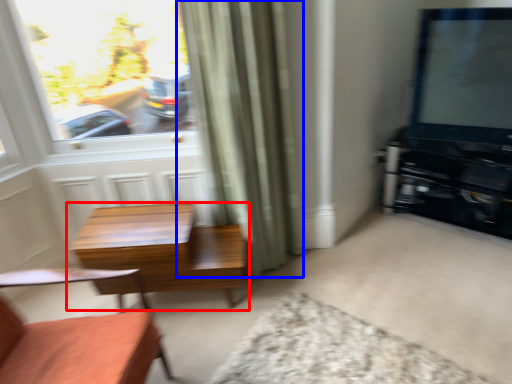
Question: Among these objects, which one is farthest to the camera, table (highlighted by a red box) or curtain (highlighted by a blue box)?

Choices:
 (A) table
 (B) curtain

Answer: (A)